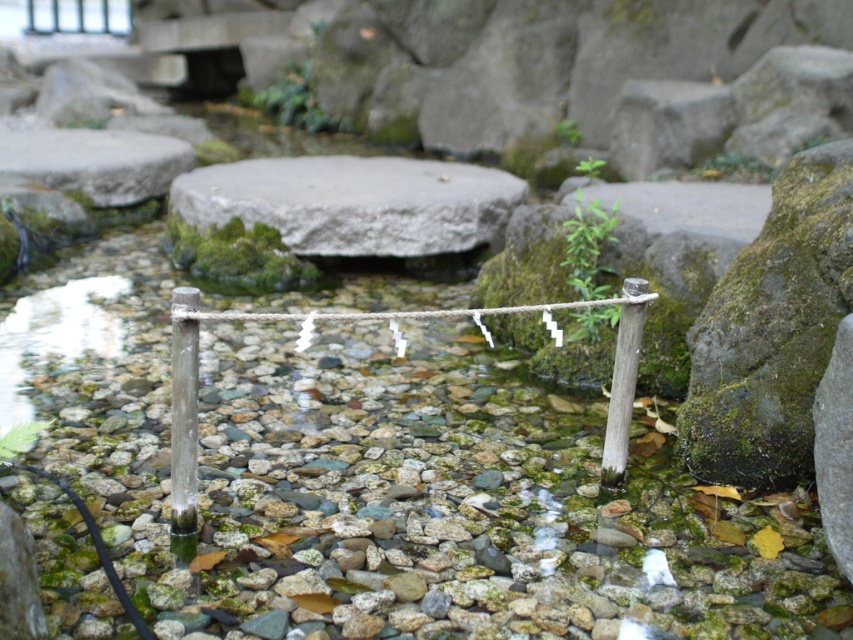
From the picture: Is gray stone boulder at center further to the viewer compared to white wood pole at right?

Yes, gray stone boulder at center is behind white wood pole at right.

Looking at this image, which of these two, gray stone boulder at center or white wood pole at right, stands shorter?

With less height is white wood pole at right.

Which is in front, point (248, 209) or point (619, 400)?

Positioned in front is point (619, 400).

What are the coordinates of `gray stone boulder at center` in the screenshot? It's located at (354, 202).

Which is above, gray stone boulder at center or white wood pole at center?

gray stone boulder at center is higher up.

Is point (270, 204) positioned after point (169, 545)?

Yes, it is.

The height and width of the screenshot is (640, 853). In order to click on gray stone boulder at center in this screenshot , I will do `click(354, 202)`.

Is point (194, 410) positioned in front of point (630, 305)?

Yes.

Is white wood pole at center in front of white wood pole at right?

Yes, white wood pole at center is in front of white wood pole at right.

Is point (178, 417) closer to camera compared to point (618, 352)?

Yes, point (178, 417) is closer to viewer.

Locate an element on the screen. The image size is (853, 640). white wood pole at center is located at coordinates (183, 438).